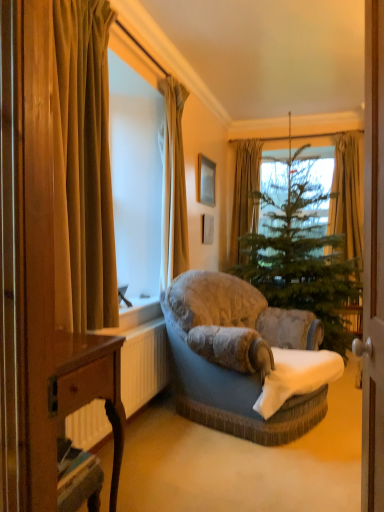
Image resolution: width=384 pixels, height=512 pixels. I want to click on vacant area that is in front of white plastic radiator at lower left, so click(x=167, y=471).